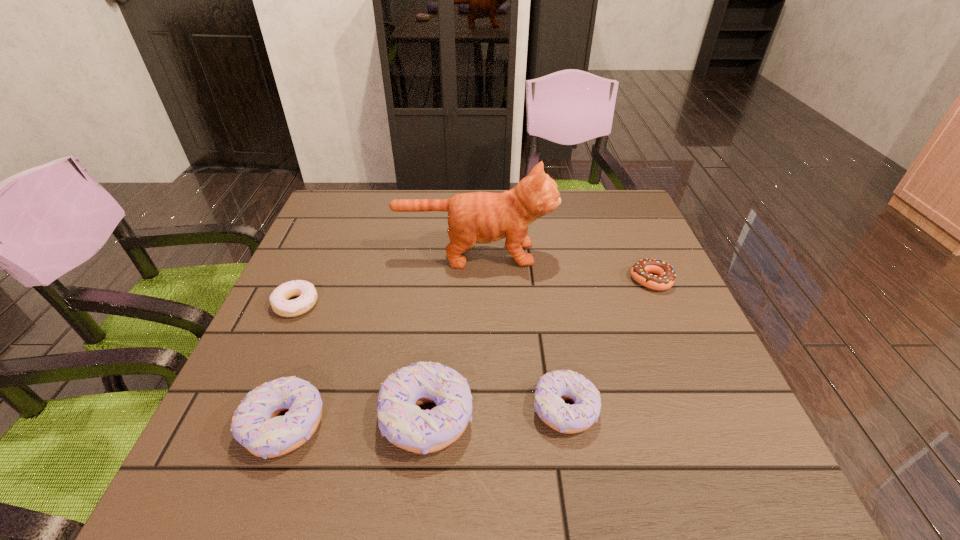
You are a GUI agent. You are given a task and a screenshot of the screen. Output one action in this format:
    pyautogui.click(x=<x>, y=<y>)
    Task: Click on the blank space located 0.330m on the front of the rightmost doughnut
    This screenshot has height=540, width=960.
    Given the screenshot: What is the action you would take?
    pyautogui.click(x=711, y=417)

This screenshot has width=960, height=540. What are the coordinates of `object at the right edge` in the screenshot? It's located at (641, 271).

I want to click on object that is at the near left corner, so click(x=256, y=425).

Locate an element on the screen. free space at the far edge of the desktop is located at coordinates (443, 190).

In the image, there is a desktop. Where is `vacant space at the near edge`? vacant space at the near edge is located at coordinates (617, 412).

In the image, there is a desktop. In order to click on vacant space at the left edge in this screenshot , I will do `click(321, 281)`.

Identify the location of vacant space at the right edge of the desktop. This screenshot has height=540, width=960. (656, 323).

Identify the location of vacant space at the far left corner of the desktop. This screenshot has height=540, width=960. (321, 234).

You are a GUI agent. You are given a task and a screenshot of the screen. Output one action in this format:
    pyautogui.click(x=<x>, y=<y>)
    Task: Click on the vacant space at the far right corner of the desktop
    This screenshot has width=960, height=540.
    Given the screenshot: What is the action you would take?
    pyautogui.click(x=608, y=214)

The width and height of the screenshot is (960, 540). Identify the location of free spot between the third shortest doughnut and the third doughnut from left to right. (496, 413).